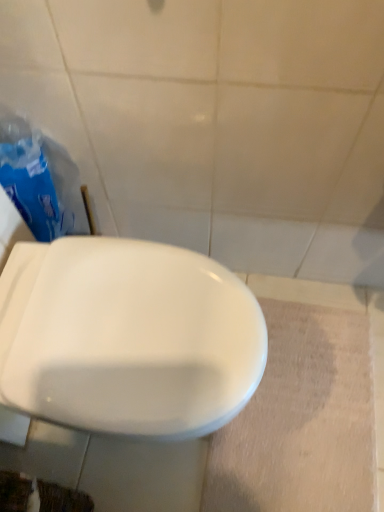
Question: Should I look upward or downward to see white glossy toilet at center?

Choices:
 (A) up
 (B) down

Answer: (B)

Question: Is white glossy toilet at center positioned in front of blue plastic bag at left?

Choices:
 (A) no
 (B) yes

Answer: (B)

Question: Is white glossy toilet at center not within blue plastic bag at left?

Choices:
 (A) yes
 (B) no

Answer: (A)

Question: Is white glossy toilet at center further to the viewer compared to blue plastic bag at left?

Choices:
 (A) no
 (B) yes

Answer: (A)

Question: Does white glossy toilet at center appear on the right side of blue plastic bag at left?

Choices:
 (A) yes
 (B) no

Answer: (A)

Question: Is white glossy toilet at center bigger than blue plastic bag at left?

Choices:
 (A) no
 (B) yes

Answer: (B)

Question: From the image's perspective, is white glossy toilet at center under blue plastic bag at left?

Choices:
 (A) no
 (B) yes

Answer: (B)

Question: Is blue plastic bag at left oriented away from white glossy toilet at center?

Choices:
 (A) no
 (B) yes

Answer: (A)

Question: Is blue plastic bag at left thinner than white glossy toilet at center?

Choices:
 (A) no
 (B) yes

Answer: (B)

Question: Can you confirm if blue plastic bag at left is positioned to the left of white glossy toilet at center?

Choices:
 (A) yes
 (B) no

Answer: (A)

Question: Considering the relative positions of blue plastic bag at left and white glossy toilet at center in the image provided, is blue plastic bag at left to the right of white glossy toilet at center from the viewer's perspective?

Choices:
 (A) yes
 (B) no

Answer: (B)

Question: From a real-world perspective, is blue plastic bag at left under white glossy toilet at center?

Choices:
 (A) yes
 (B) no

Answer: (B)

Question: Does blue plastic bag at left come in front of white glossy toilet at center?

Choices:
 (A) yes
 (B) no

Answer: (B)

Question: From the image's perspective, is white glossy toilet at center above or below blue plastic bag at left?

Choices:
 (A) above
 (B) below

Answer: (B)